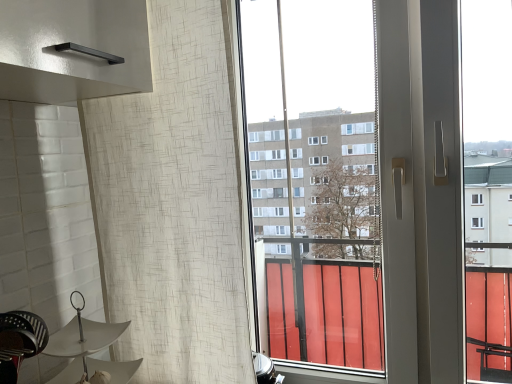
Question: Is metallic black swivel chair at lower left aimed at white matte umbrella at lower left?

Choices:
 (A) no
 (B) yes

Answer: (A)

Question: Does metallic black swivel chair at lower left have a lesser height compared to white matte umbrella at lower left?

Choices:
 (A) yes
 (B) no

Answer: (A)

Question: Is the position of metallic black swivel chair at lower left less distant than that of white matte umbrella at lower left?

Choices:
 (A) yes
 (B) no

Answer: (A)

Question: Is metallic black swivel chair at lower left positioned far away from white matte umbrella at lower left?

Choices:
 (A) yes
 (B) no

Answer: (B)

Question: Can white matte umbrella at lower left be found inside metallic black swivel chair at lower left?

Choices:
 (A) no
 (B) yes

Answer: (A)

Question: Is the surface of metallic black swivel chair at lower left in direct contact with white matte umbrella at lower left?

Choices:
 (A) yes
 (B) no

Answer: (A)

Question: Could you tell me if white matte umbrella at lower left is turned towards metallic black swivel chair at lower left?

Choices:
 (A) no
 (B) yes

Answer: (A)

Question: Considering the relative positions of white matte umbrella at lower left and metallic black swivel chair at lower left in the image provided, is white matte umbrella at lower left in front of metallic black swivel chair at lower left?

Choices:
 (A) yes
 (B) no

Answer: (B)

Question: From the image's perspective, is white matte umbrella at lower left on top of metallic black swivel chair at lower left?

Choices:
 (A) no
 (B) yes

Answer: (A)

Question: Can you confirm if white matte umbrella at lower left is positioned to the left of metallic black swivel chair at lower left?

Choices:
 (A) yes
 (B) no

Answer: (B)

Question: Is white matte umbrella at lower left outside of metallic black swivel chair at lower left?

Choices:
 (A) no
 (B) yes

Answer: (B)

Question: Is white matte umbrella at lower left beside metallic black swivel chair at lower left?

Choices:
 (A) no
 (B) yes

Answer: (B)

Question: From the image's perspective, is white textured curtain at left on top of white matte umbrella at lower left?

Choices:
 (A) yes
 (B) no

Answer: (A)